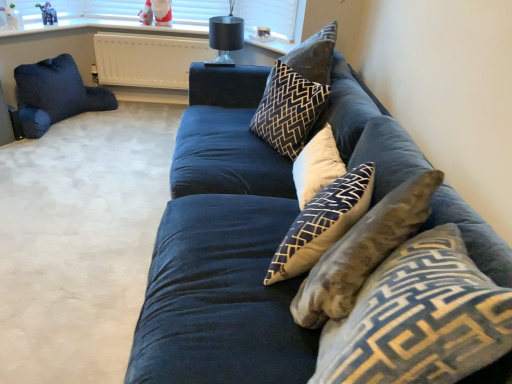
Question: Is matte plastic santa at upper center, which appears as the 1th toy when viewed from the back, placed right next to black glass lamp at upper center?

Choices:
 (A) yes
 (B) no

Answer: (B)

Question: Does matte plastic santa at upper center, the third toy from the front, lie in front of black glass lamp at upper center?

Choices:
 (A) yes
 (B) no

Answer: (B)

Question: Is matte plastic santa at upper center, which appears as the first toy when viewed from the right, facing towards black glass lamp at upper center?

Choices:
 (A) yes
 (B) no

Answer: (B)

Question: From the image's perspective, would you say matte plastic santa at upper center, the 3th toy when ordered from left to right, is positioned over black glass lamp at upper center?

Choices:
 (A) yes
 (B) no

Answer: (A)

Question: From a real-world perspective, is matte plastic santa at upper center, the third toy from the front, on black glass lamp at upper center?

Choices:
 (A) yes
 (B) no

Answer: (A)

Question: From the image's perspective, would you say matte plastic santa at upper center, which appears as the first toy when viewed from the right, is shown under black glass lamp at upper center?

Choices:
 (A) no
 (B) yes

Answer: (A)

Question: From the image's perspective, is white cotton cushion at center, placed as the third pillow when sorted from right to left, beneath dark blue velvet pillow at left, which is the 5th pillow from right to left?

Choices:
 (A) yes
 (B) no

Answer: (A)

Question: Can you confirm if white cotton cushion at center, the fourth pillow positioned from the back, is wider than dark blue velvet pillow at left, which is the 5th pillow from right to left?

Choices:
 (A) yes
 (B) no

Answer: (B)

Question: Is white cotton cushion at center, which is the third pillow in left-to-right order, not inside dark blue velvet pillow at left, which is the fifth pillow from front to back?

Choices:
 (A) yes
 (B) no

Answer: (A)

Question: Is white cotton cushion at center, the fourth pillow positioned from the back, positioned in front of dark blue velvet pillow at left, which is the first pillow from back to front?

Choices:
 (A) no
 (B) yes

Answer: (B)

Question: Considering the relative sizes of white cotton cushion at center, which is the second pillow from front to back, and dark blue velvet pillow at left, which is the fifth pillow from front to back, in the image provided, is white cotton cushion at center, which is the second pillow from front to back, bigger than dark blue velvet pillow at left, which is the fifth pillow from front to back,?

Choices:
 (A) no
 (B) yes

Answer: (A)

Question: Could you tell me if dark blue velvet pillow at left, which is the 5th pillow from right to left, is turned towards matte plastic santa at upper center, which appears as the first toy when viewed from the right?

Choices:
 (A) yes
 (B) no

Answer: (B)